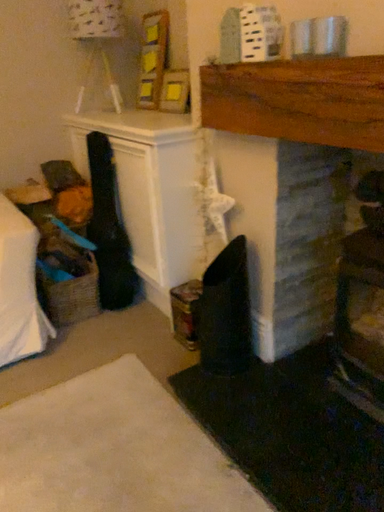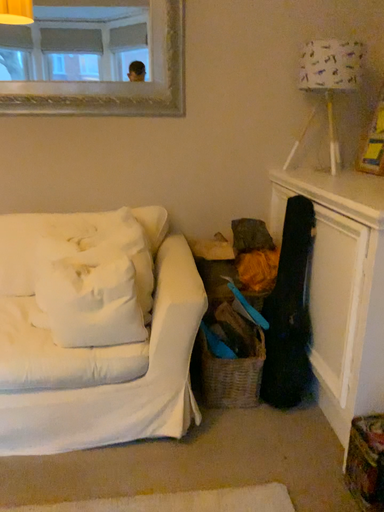
Question: Which way did the camera rotate in the video?

Choices:
 (A) rotated upward
 (B) rotated downward

Answer: (A)